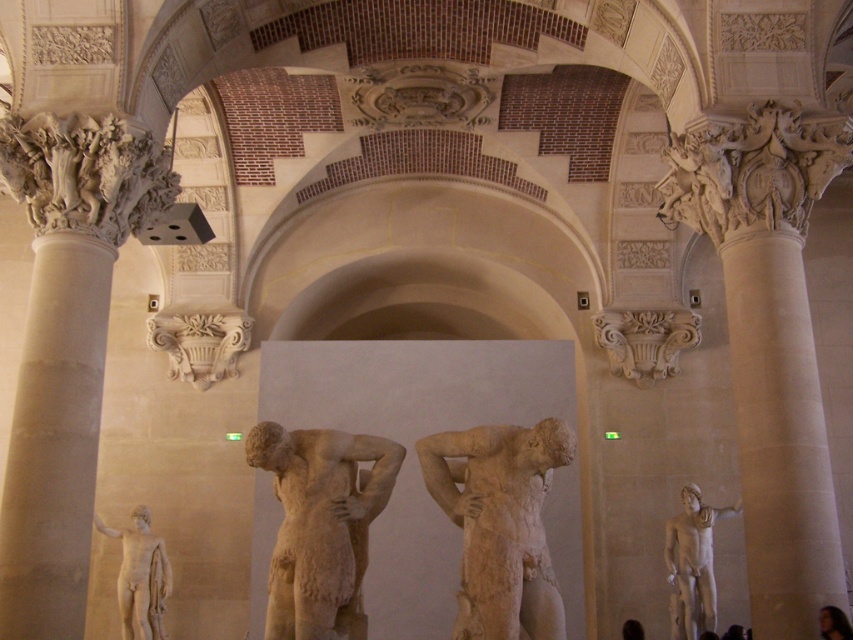
Between white marble column at right and carved stone ornament at upper right, which one has less height?

carved stone ornament at upper right is shorter.

Who is higher up, white marble column at right or carved stone ornament at upper right?

carved stone ornament at upper right

I want to click on white marble column at right, so click(x=780, y=435).

Identify the location of white marble column at right. (780, 435).

Does white marble statue at right have a lesser width compared to smooth skin figure at center?

No, white marble statue at right is not thinner than smooth skin figure at center.

Between point (701, 627) and point (637, 628), which one is positioned in front?

Positioned in front is point (701, 627).

Locate an element on the screen. white marble statue at right is located at coordinates (692, 563).

Identify the location of white marble statue at right. (692, 563).

The height and width of the screenshot is (640, 853). Identify the location of white marble statue at center. (500, 524).

Can you confirm if white marble statue at center is wider than beige stone statue at center?

Yes.

Between point (421, 445) and point (250, 435), which one is positioned in front?

Point (250, 435) is in front.

Identify the location of white marble statue at center. (500, 524).